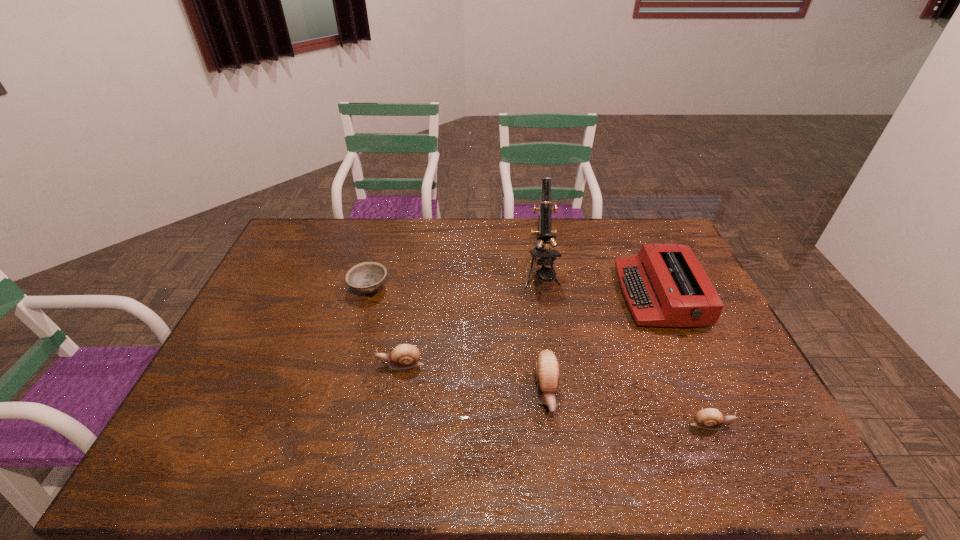
You are a GUI agent. You are given a task and a screenshot of the screen. Output one action in this format:
    pyautogui.click(x=<x>, y=<y>)
    Task: Click on the vacant space positioned 0.080m on the front-facing side of the rightmost escargot
    This screenshot has width=960, height=540.
    Given the screenshot: What is the action you would take?
    [x=764, y=424]

In order to click on free location located on the typing side of the typewriter in this screenshot , I will do `click(575, 295)`.

This screenshot has height=540, width=960. In order to click on vacant space situated on the typing side of the typewriter in this screenshot , I will do `click(593, 295)`.

Locate an element on the screen. vacant space located on the typing side of the typewriter is located at coordinates (535, 295).

At what (x,y) coordinates should I click in order to perform the action: click on free region located on the front of the leftmost object. Please return your answer as a coordinate pair (x, y). This screenshot has height=540, width=960. Looking at the image, I should click on (360, 323).

Where is `free space located through the eyepiece of the microscope`? This screenshot has height=540, width=960. free space located through the eyepiece of the microscope is located at coordinates (552, 346).

You are a GUI agent. You are given a task and a screenshot of the screen. Output one action in this format:
    pyautogui.click(x=<x>, y=<y>)
    Task: Click on the object at the far edge
    
    Given the screenshot: What is the action you would take?
    pyautogui.click(x=544, y=233)

Identify the location of escargot at the right edge. This screenshot has width=960, height=540. (709, 418).

Where is `typewriter present at the right edge`? The image size is (960, 540). typewriter present at the right edge is located at coordinates (665, 285).

Find the location of a particular element. The image size is (960, 540). object located in the near right corner section of the desktop is located at coordinates (709, 418).